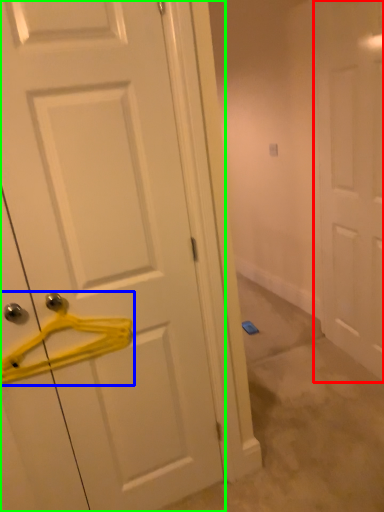
Question: Considering the real-world distances, which object is closest to door (highlighted by a red box)? hanger (highlighted by a blue box) or door (highlighted by a green box).

Choices:
 (A) hanger
 (B) door

Answer: (B)